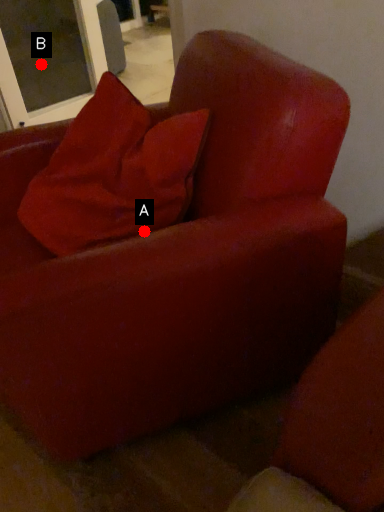
Question: Two points are circled on the image, labeled by A and B beside each circle. Which point is closer to the camera?

Choices:
 (A) A is closer
 (B) B is closer

Answer: (A)